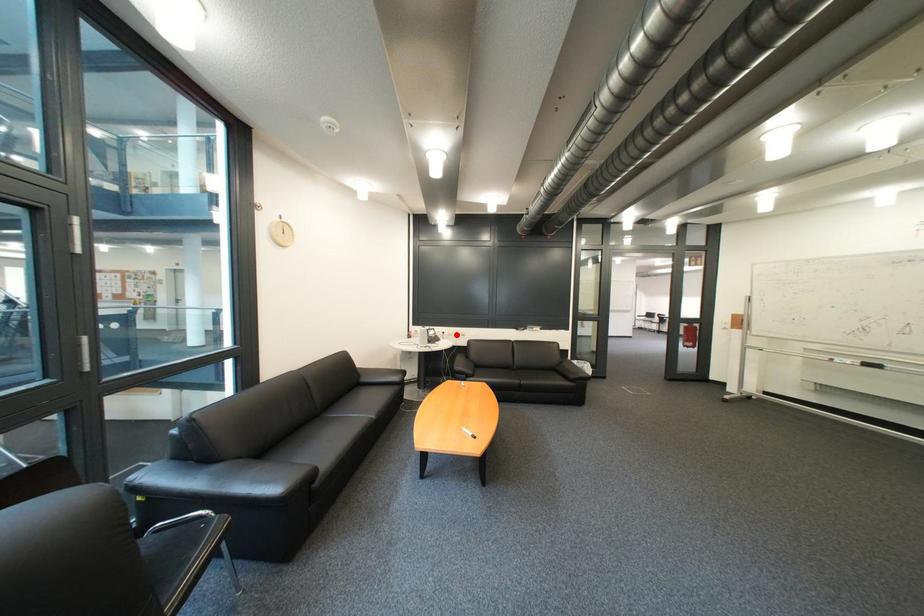
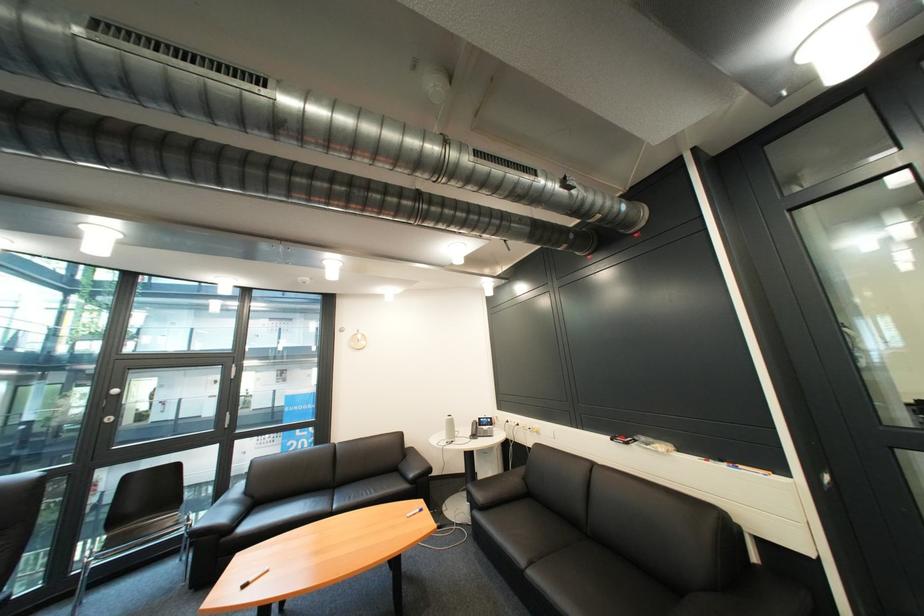
Find the pixel in the second image that matches the highlighted location in the first image.

(531, 426)